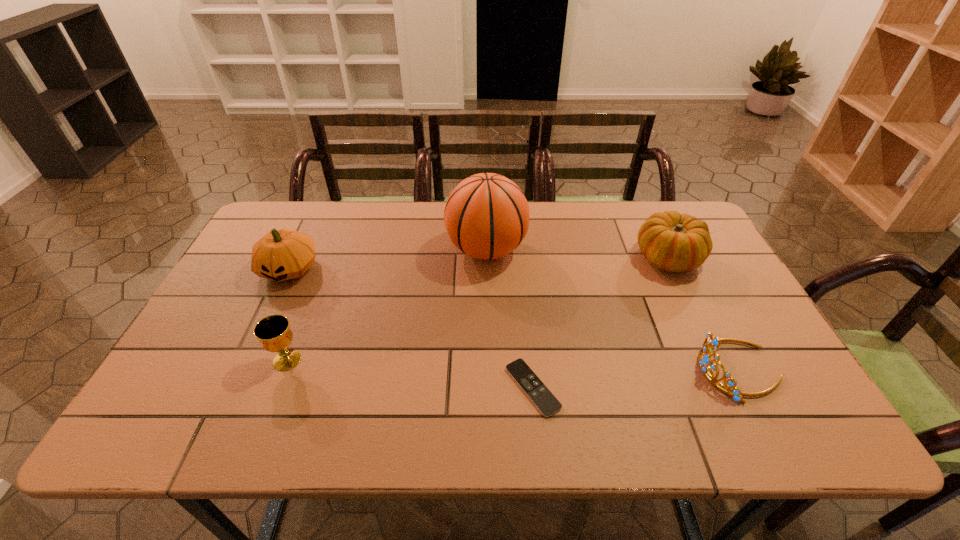
Locate an element on the screen. vacant point that satisfies the following two spatial constraints: 1. on the side of the chalice with the carved face; 2. on the left side of the left gourd is located at coordinates (247, 360).